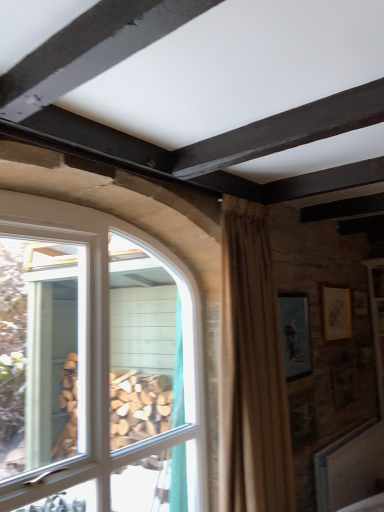
Question: From a real-world perspective, is matte gold picture frame at upper right, placed as the 1th picture frame when sorted from right to left, physically located above or below white glass window at left?

Choices:
 (A) below
 (B) above

Answer: (B)

Question: Is matte gold picture frame at upper right, which ranks as the second picture frame in left-to-right order, inside or outside of white glass window at left?

Choices:
 (A) inside
 (B) outside

Answer: (B)

Question: Which is nearer to the white glass window at left?

Choices:
 (A) matte blue picture frame at upper right, the first picture frame from the left
 (B) beige textured curtain at center
 (C) matte gold picture frame at upper right, marked as the 1th picture frame in a back-to-front arrangement

Answer: (B)

Question: Estimate the real-world distances between objects in this image. Which object is farther from the white glass window at left?

Choices:
 (A) beige textured curtain at center
 (B) matte blue picture frame at upper right, which appears as the 2th picture frame when viewed from the back
 (C) matte gold picture frame at upper right, marked as the 1th picture frame in a back-to-front arrangement

Answer: (C)